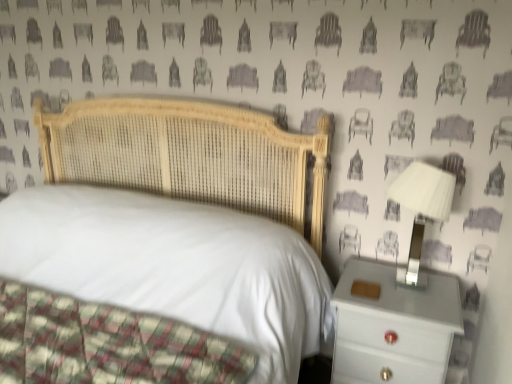
Where is `vacant space underneath white plastic lampshade at right (from a real-world perspective)`? This screenshot has height=384, width=512. vacant space underneath white plastic lampshade at right (from a real-world perspective) is located at coordinates (415, 286).